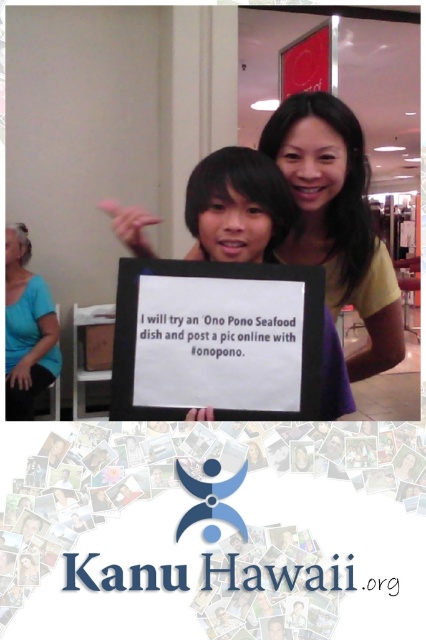
Question: Which point is farther to the camera?

Choices:
 (A) blue fabric shirt at left
 (B) white paper sign at center

Answer: (A)

Question: Which point is farther from the camera taking this photo?

Choices:
 (A) (210, 259)
 (B) (46, 348)

Answer: (B)

Question: Does white paper sign at center have a lesser width compared to blue fabric shirt at left?

Choices:
 (A) yes
 (B) no

Answer: (B)

Question: In this image, where is white paper sign at center located relative to blue fabric shirt at left?

Choices:
 (A) above
 (B) below

Answer: (A)

Question: Which of the following is the farthest from the observer?

Choices:
 (A) blue fabric shirt at left
 (B) white paper sign at center

Answer: (A)

Question: From the image, what is the correct spatial relationship of white paper sign at center in relation to blue fabric shirt at left?

Choices:
 (A) right
 (B) left

Answer: (A)